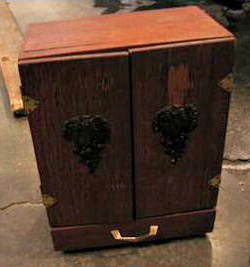
I want to click on wood piece, so click(12, 47).